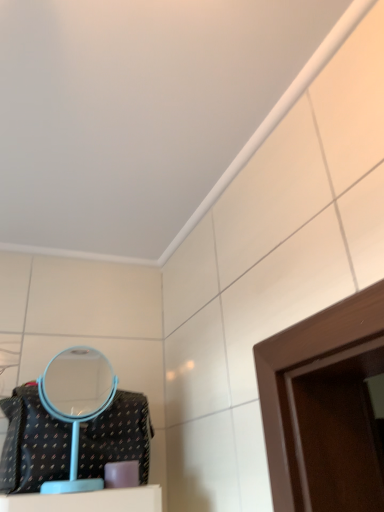
What do you see at coordinates (32, 444) in the screenshot? The width and height of the screenshot is (384, 512). I see `black textured fabric bag at lower left` at bounding box center [32, 444].

Find the location of a particular element. black textured fabric bag at lower left is located at coordinates (32, 444).

The width and height of the screenshot is (384, 512). In order to click on light blue plastic mirror at lower left in this screenshot , I will do `click(76, 403)`.

Image resolution: width=384 pixels, height=512 pixels. What do you see at coordinates (76, 403) in the screenshot?
I see `light blue plastic mirror at lower left` at bounding box center [76, 403].

Locate an element on the screen. black textured fabric bag at lower left is located at coordinates (32, 444).

Considering the positions of objects light blue plastic mirror at lower left and black textured fabric bag at lower left in the image provided, who is more to the right, light blue plastic mirror at lower left or black textured fabric bag at lower left?

From the viewer's perspective, light blue plastic mirror at lower left appears more on the right side.

Considering their positions, is light blue plastic mirror at lower left located in front of or behind black textured fabric bag at lower left?

light blue plastic mirror at lower left is positioned farther from the viewer than black textured fabric bag at lower left.

Between point (82, 351) and point (23, 442), which one is positioned in front?

The point (23, 442) is closer.

From the image's perspective, which is above, light blue plastic mirror at lower left or black textured fabric bag at lower left?

light blue plastic mirror at lower left appears higher in the image.

From a real-world perspective, who is located higher, light blue plastic mirror at lower left or black textured fabric bag at lower left?

light blue plastic mirror at lower left, from a real-world perspective.

Considering the sizes of light blue plastic mirror at lower left and black textured fabric bag at lower left in the image, is light blue plastic mirror at lower left wider or thinner than black textured fabric bag at lower left?

Clearly, light blue plastic mirror at lower left has less width compared to black textured fabric bag at lower left.

Who is shorter, light blue plastic mirror at lower left or black textured fabric bag at lower left?

With less height is black textured fabric bag at lower left.

Who is smaller, light blue plastic mirror at lower left or black textured fabric bag at lower left?

Smaller between the two is light blue plastic mirror at lower left.

Is light blue plastic mirror at lower left not within black textured fabric bag at lower left?

Absolutely, light blue plastic mirror at lower left is external to black textured fabric bag at lower left.

Are light blue plastic mirror at lower left and black textured fabric bag at lower left making contact?

No, light blue plastic mirror at lower left is not in contact with black textured fabric bag at lower left.

Could you tell me if light blue plastic mirror at lower left is turned towards black textured fabric bag at lower left?

Yes.

How different are the orientations of light blue plastic mirror at lower left and black textured fabric bag at lower left in degrees?

They differ by 0.385 degrees in their facing directions.

How much distance is there between light blue plastic mirror at lower left and black textured fabric bag at lower left?

light blue plastic mirror at lower left and black textured fabric bag at lower left are 4.02 feet apart from each other.

Image resolution: width=384 pixels, height=512 pixels. What are the coordinates of `clothing that is below the light blue plastic mirror at lower left (from the image's perspective)` in the screenshot? It's located at 32,444.

Which object is positioned more to the right, black textured fabric bag at lower left or light blue plastic mirror at lower left?

light blue plastic mirror at lower left is more to the right.

Is black textured fabric bag at lower left in front of or behind light blue plastic mirror at lower left in the image?

Clearly, black textured fabric bag at lower left is in front of light blue plastic mirror at lower left.

Between point (54, 432) and point (97, 358), which one is positioned in front?

The point (54, 432) is closer.

From the image's perspective, is black textured fabric bag at lower left on top of light blue plastic mirror at lower left?

No.

From a real-world perspective, is black textured fabric bag at lower left positioned under light blue plastic mirror at lower left based on gravity?

Yes, from a real-world perspective, black textured fabric bag at lower left is beneath light blue plastic mirror at lower left.

Is black textured fabric bag at lower left thinner than light blue plastic mirror at lower left?

No.

In terms of height, does black textured fabric bag at lower left look taller or shorter compared to light blue plastic mirror at lower left?

In the image, black textured fabric bag at lower left appears to be shorter than light blue plastic mirror at lower left.

Is black textured fabric bag at lower left bigger or smaller than light blue plastic mirror at lower left?

black textured fabric bag at lower left is bigger than light blue plastic mirror at lower left.

Is light blue plastic mirror at lower left a part of black textured fabric bag at lower left?

No, light blue plastic mirror at lower left is not a part of black textured fabric bag at lower left.

Is black textured fabric bag at lower left far away from light blue plastic mirror at lower left?

That's right, there is a large distance between black textured fabric bag at lower left and light blue plastic mirror at lower left.

Could you tell me if black textured fabric bag at lower left is turned towards light blue plastic mirror at lower left?

Yes.

The width and height of the screenshot is (384, 512). In order to click on clothing lying below the light blue plastic mirror at lower left (from the image's perspective) in this screenshot , I will do `click(32, 444)`.

Locate an element on the screen. clothing in front of the light blue plastic mirror at lower left is located at coordinates (32, 444).

Find the location of `mirror on the right of black textured fabric bag at lower left`. mirror on the right of black textured fabric bag at lower left is located at coordinates (76, 403).